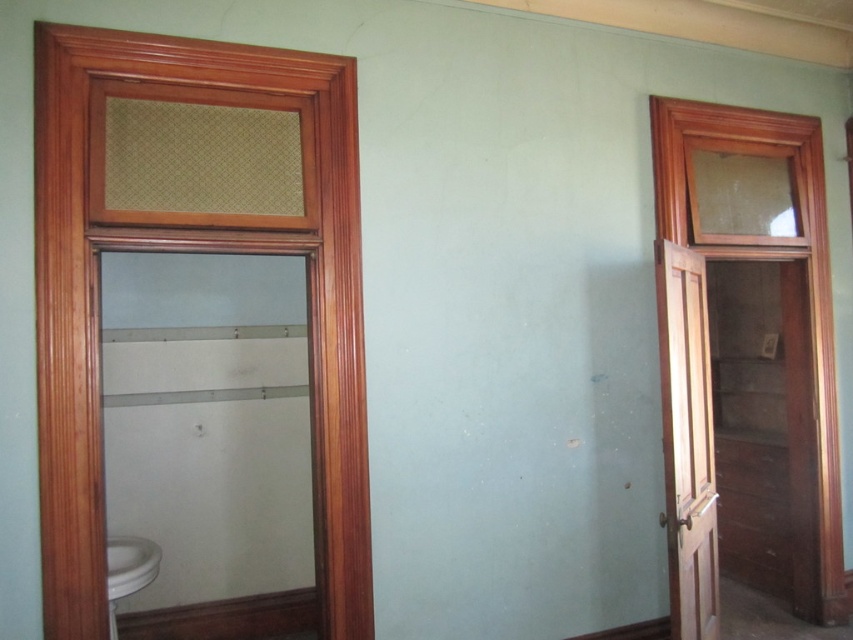
Between point (38, 291) and point (717, 592), which one is positioned behind?

Point (717, 592)

Is point (47, 470) behind point (679, 436)?

No, it is in front of (679, 436).

You are a GUI agent. You are given a task and a screenshot of the screen. Output one action in this format:
    pyautogui.click(x=<x>, y=<y>)
    Task: Click on the wooden textured window at left
    
    Given the screenshot: What is the action you would take?
    pyautogui.click(x=189, y=250)

Looking at this image, who is shorter, wooden textured window at left or white glossy sink at lower left?

Standing shorter between the two is white glossy sink at lower left.

Measure the distance between wooden textured window at left and camera.

They are 2.34 meters apart.

This screenshot has width=853, height=640. What are the coordinates of `wooden textured window at left` in the screenshot? It's located at [x=189, y=250].

Between light brown wooden screen door at right and white glossy sink at lower left, which one appears on the left side from the viewer's perspective?

white glossy sink at lower left

Which of these two, light brown wooden screen door at right or white glossy sink at lower left, stands shorter?

With less height is white glossy sink at lower left.

Image resolution: width=853 pixels, height=640 pixels. Identify the location of light brown wooden screen door at right. click(688, 442).